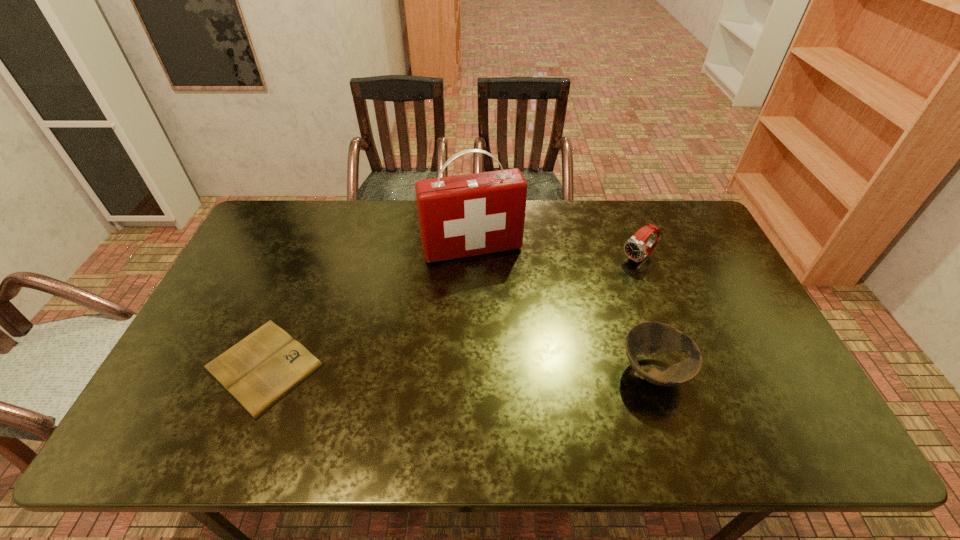
Locate an element on the screen. This screenshot has width=960, height=540. book is located at coordinates (257, 372).

You are a GUI agent. You are given a task and a screenshot of the screen. Output one action in this format:
    pyautogui.click(x=<x>, y=<y>)
    Task: Click on the shortest object
    
    Given the screenshot: What is the action you would take?
    pyautogui.click(x=257, y=372)

Where is `the second shortest object`? The image size is (960, 540). the second shortest object is located at coordinates (645, 338).

The image size is (960, 540). I want to click on the tallest object, so click(473, 214).

Where is `the third object from right to left`? Image resolution: width=960 pixels, height=540 pixels. the third object from right to left is located at coordinates (473, 214).

At what (x,y) coordinates should I click in order to perform the action: click on the second tallest object. Please return your answer as a coordinate pair (x, y). The width and height of the screenshot is (960, 540). Looking at the image, I should click on click(635, 248).

Find the location of a particular element. The width and height of the screenshot is (960, 540). free space located on the back of the leftmost object is located at coordinates (301, 273).

The image size is (960, 540). Identify the location of vacant point located 0.210m on the right of the bowl. (771, 371).

Find the location of a particular element. vacant space situated on the front face of the first-aid kit is located at coordinates (502, 316).

Locate an element on the screen. vacant area located on the front face of the first-aid kit is located at coordinates (516, 356).